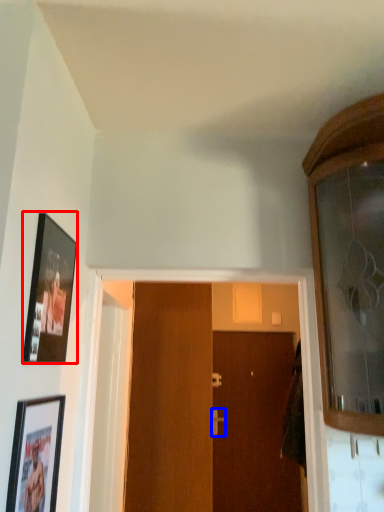
Question: Which point is closer to the camera, picture frame (highlighted by a red box) or door handle (highlighted by a blue box)?

Choices:
 (A) picture frame
 (B) door handle

Answer: (A)